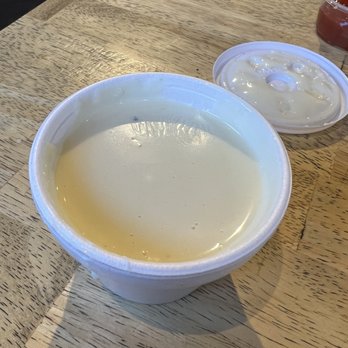
The image size is (348, 348). Find the location of `rim of white cup`. rim of white cup is located at coordinates (203, 80).